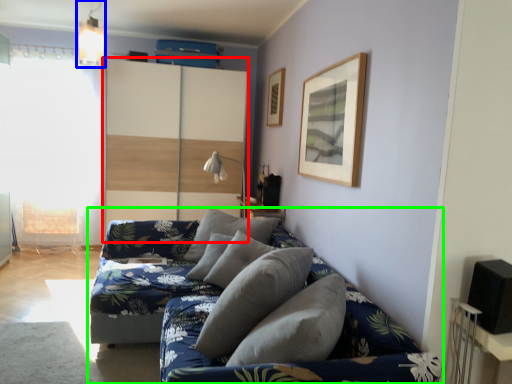
Question: Considering the real-world distances, which object is farthest from dresser (highlighted by a red box)? light fixture (highlighted by a blue box) or studio couch (highlighted by a green box)?

Choices:
 (A) light fixture
 (B) studio couch

Answer: (B)